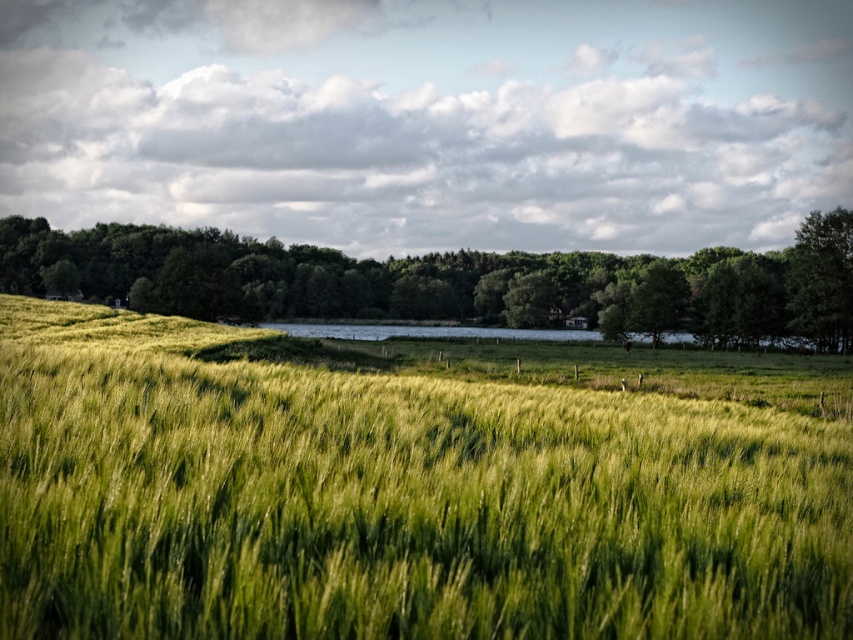
Question: Does green grassy wheat field at center appear on the right side of green leafy tree at upper right?

Choices:
 (A) yes
 (B) no

Answer: (B)

Question: Which object appears closest to the camera in this image?

Choices:
 (A) green grassy wheat field at center
 (B) green leafy tree at center

Answer: (A)

Question: Which point appears farthest from the camera in this image?

Choices:
 (A) (186, 275)
 (B) (828, 288)

Answer: (A)

Question: Can you confirm if green grassy wheat field at center is positioned above green leafy tree at center?

Choices:
 (A) no
 (B) yes

Answer: (A)

Question: Which point is closer to the camera?

Choices:
 (A) green leafy tree at center
 (B) green grassy wheat field at center
 (C) green leafy tree at upper right

Answer: (B)

Question: Can you confirm if green leafy tree at center is positioned above green leafy tree at upper right?

Choices:
 (A) no
 (B) yes

Answer: (B)